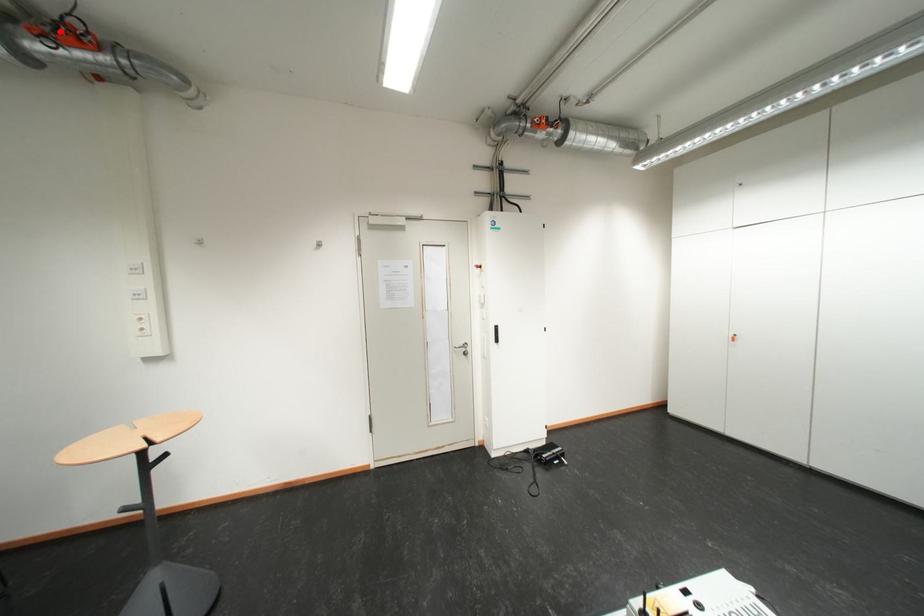
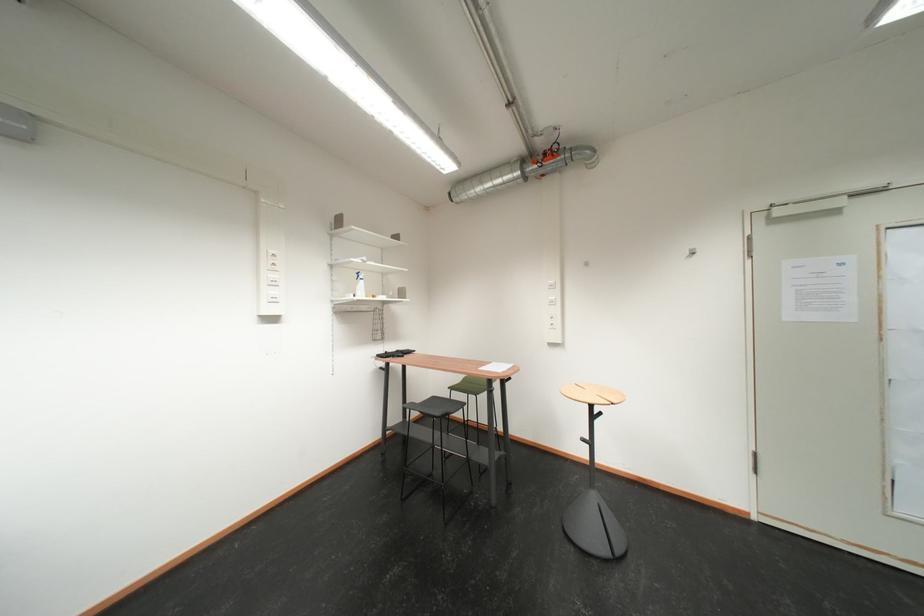
Where in the second image is the point corresponding to the highlighted location from the first image?

(552, 160)